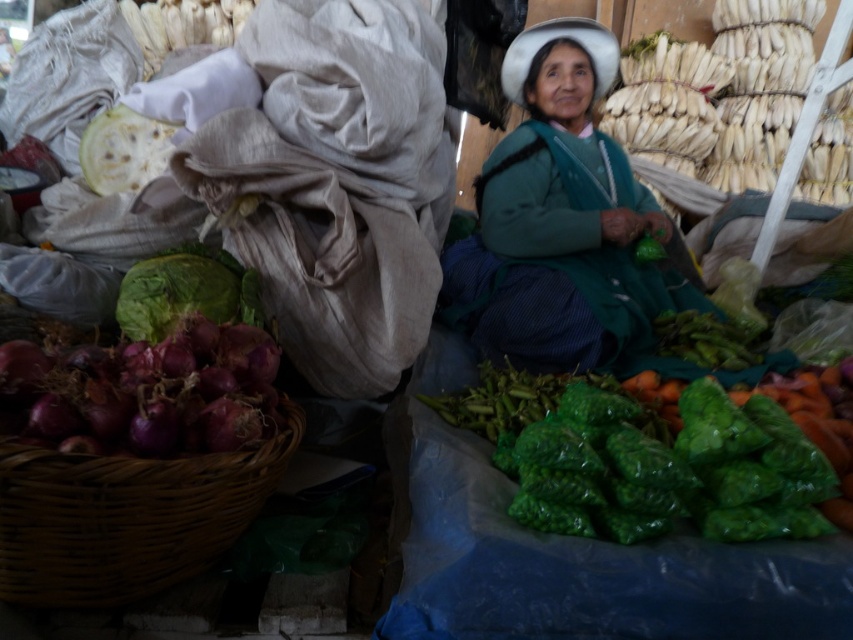
Question: Which of the following is the closest to the observer?

Choices:
 (A) (178, 403)
 (B) (148, 592)
 (C) (654, 243)
 (D) (567, 285)

Answer: (A)

Question: Is green fabric at center smaller than purple matte onion at lower left?

Choices:
 (A) yes
 (B) no

Answer: (B)

Question: Which of the following is the closest to the observer?

Choices:
 (A) 163,392
 (B) 152,298

Answer: (A)

Question: Where is green fabric at center located in relation to green leafy at center in the image?

Choices:
 (A) left
 (B) right

Answer: (A)

Question: Does brown wicker basket at lower left have a larger size compared to purple matte onion at lower left?

Choices:
 (A) yes
 (B) no

Answer: (A)

Question: Which point is farther to the camera?

Choices:
 (A) (521, 250)
 (B) (39, 524)
 (C) (194, 266)
 (D) (86, 172)

Answer: (A)